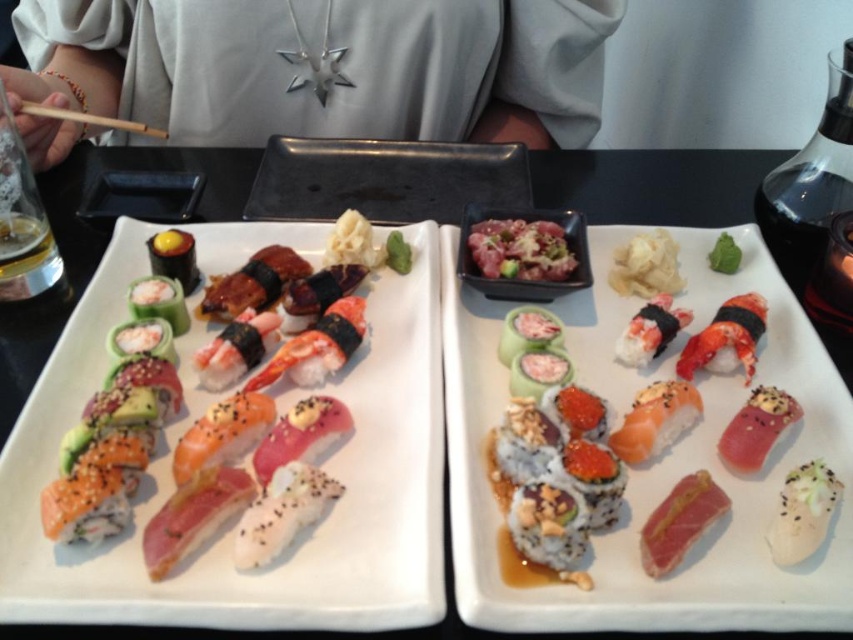
Who is positioned more to the right, yellow-topped raw tuna at center or pink sesame seed at center?

From the viewer's perspective, pink sesame seed at center appears more on the right side.

Who is more forward, [668,500] or [718,442]?

Point [668,500] is more forward.

What do you see at coordinates (679, 522) in the screenshot? This screenshot has width=853, height=640. I see `yellow-topped raw tuna at center` at bounding box center [679, 522].

Identify the location of yellow-topped raw tuna at center. Image resolution: width=853 pixels, height=640 pixels. (679, 522).

Is point (335, 147) closer to camera compared to point (688, 502)?

No, it is not.

Does black ceramic tray at center appear under yellow-topped raw tuna at center?

No.

This screenshot has width=853, height=640. In order to click on black ceramic tray at center in this screenshot , I will do `click(384, 179)`.

Does white fabric at upper center have a lesser width compared to white matte sushi at center?

No, white fabric at upper center is not thinner than white matte sushi at center.

Between point (502, 20) and point (480, 380), which one is positioned behind?

The point (502, 20) is behind.

At what (x,y) coordinates should I click in order to perform the action: click on white fabric at upper center. Please return your answer as a coordinate pair (x, y). This screenshot has width=853, height=640. Looking at the image, I should click on (323, 67).